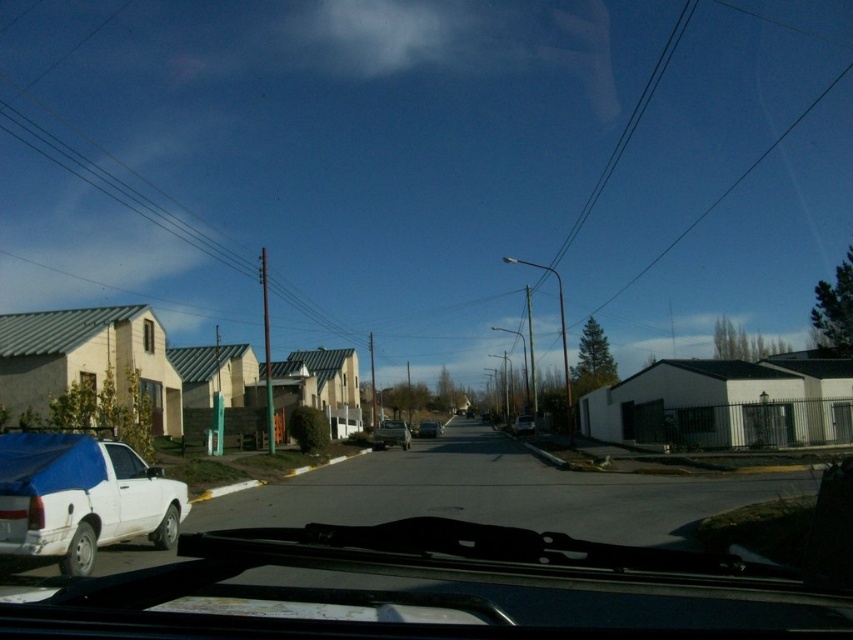
You are driving a car and looking through the windshield. You see a white matte car window at lower left and a silver metallic car at center. Which object is nearer to you?

The white matte car window at lower left is closer to the viewer than the silver metallic car at center.

You are driving a vehicle and need to park in a parking spot that can only accommodate vehicles up to the size of the silver metallic car at center. Can the white matte truck at left fit in this parking spot?

The white matte truck at left has a smaller size compared to the silver metallic car at center, so it can fit in the parking spot designed for the silver metallic car at center.